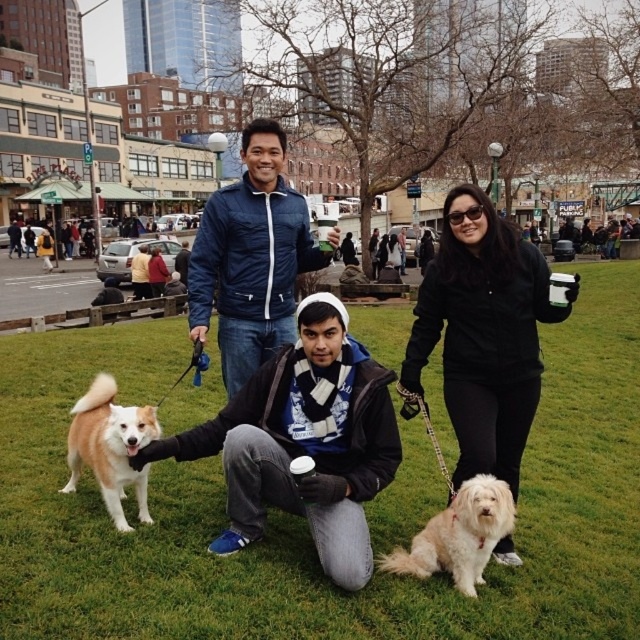
Which of these two, green grass at center or fluffy white dog at center, stands shorter?

With less height is fluffy white dog at center.

Between green grass at center and fluffy white dog at center, which one is positioned lower?

fluffy white dog at center is below.

Which is behind, point (397, 598) or point (333, 531)?

Positioned behind is point (333, 531).

The height and width of the screenshot is (640, 640). In order to click on green grass at center in this screenshot , I will do `click(305, 522)`.

Between fluffy white dog at center and light brown fur dog at center, which one has more height?

fluffy white dog at center

Between fluffy white dog at center and light brown fur dog at center, which one is positioned higher?

light brown fur dog at center

Image resolution: width=640 pixels, height=640 pixels. What do you see at coordinates (304, 442) in the screenshot? I see `fluffy white dog at center` at bounding box center [304, 442].

I want to click on fluffy white dog at center, so click(304, 442).

The image size is (640, 640). Describe the element at coordinates (252, 259) in the screenshot. I see `matte blue jacket at center` at that location.

What do you see at coordinates (252, 259) in the screenshot? I see `matte blue jacket at center` at bounding box center [252, 259].

You are a GUI agent. You are given a task and a screenshot of the screen. Output one action in this format:
    pyautogui.click(x=<x>, y=<y>)
    Task: Click on the matte blue jacket at center
    This screenshot has height=640, width=640.
    Given the screenshot: What is the action you would take?
    pyautogui.click(x=252, y=259)